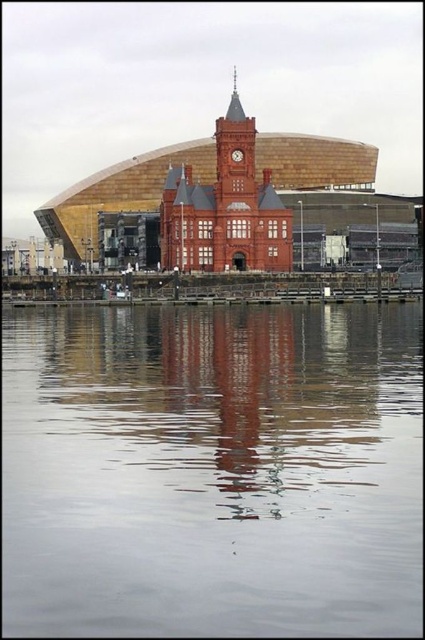
You are standing at the center of the image and want to walk to the smooth gray water at center. Which direction should you move in to reach it?

Since the smooth gray water at center is located at point 0.736 on the x axis and 0.501 on the y axis, you should move to the right to reach it.

Based on the photo, you are standing on the edge of the smooth gray water at center and want to look up at the matte brick clock tower at center. In which direction should you turn your head?

You should look upward because the smooth gray water at center is located below the matte brick clock tower at center.

You are standing on the path near the smooth gray water at center and the matte brick clock tower at center. Which object is closer to you?

The smooth gray water at center is closer to you since it is in front of the matte brick clock tower at center.